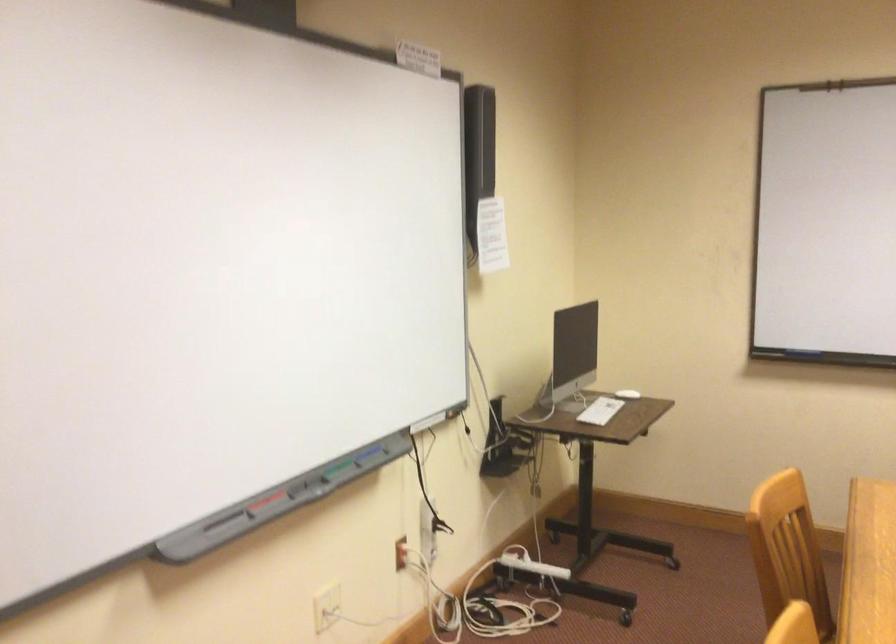
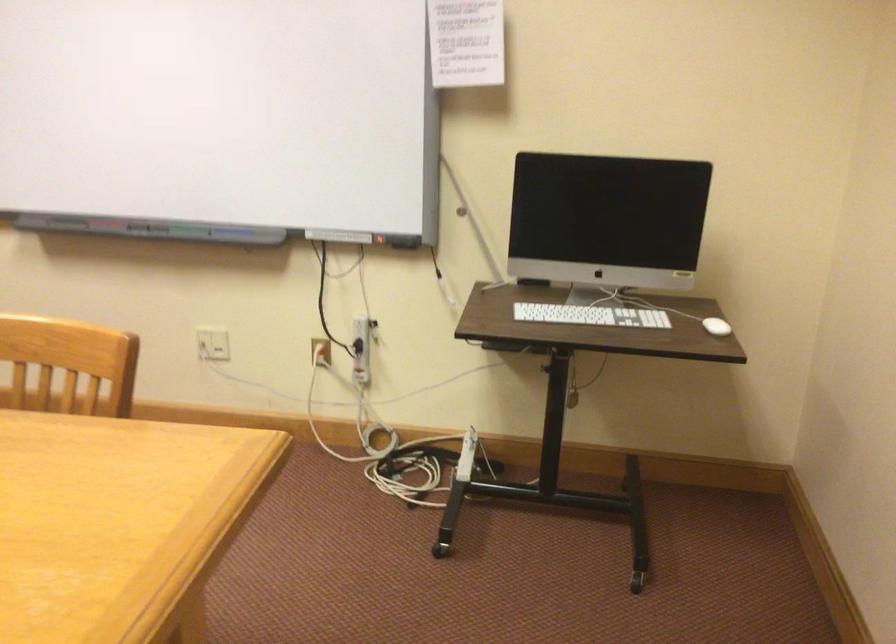
In the second image, find the point that corresponds to point (359, 466) in the first image.

(187, 230)